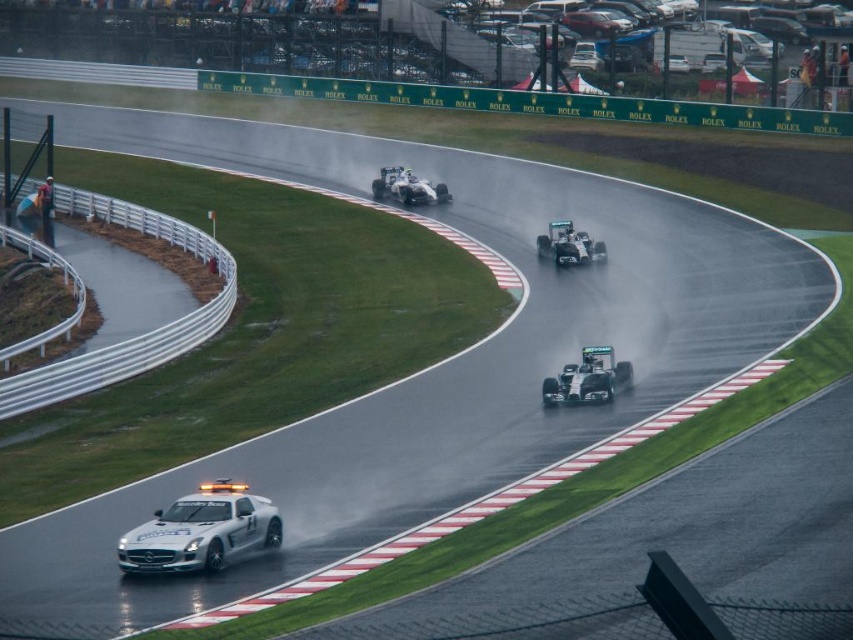
Between white glossy car at lower left and metallic silver race car at upper center, which one has less height?

With less height is white glossy car at lower left.

Is white glossy car at lower left above metallic silver race car at upper center?

No.

Between point (224, 545) and point (753, 19), which one is positioned behind?

The point (753, 19) is more distant.

Where is `white glossy car at lower left`? Image resolution: width=853 pixels, height=640 pixels. white glossy car at lower left is located at coordinates (201, 531).

Is point (788, 22) positioned after point (440, 196)?

Yes, point (788, 22) is farther from viewer.

This screenshot has width=853, height=640. Describe the element at coordinates (781, 33) in the screenshot. I see `metallic silver race car at upper center` at that location.

This screenshot has width=853, height=640. I want to click on metallic silver race car at upper center, so click(781, 33).

Between point (590, 365) and point (561, 230), which one is positioned in front?

Point (590, 365) is more forward.

Identify the location of silver metallic race car at center. (587, 378).